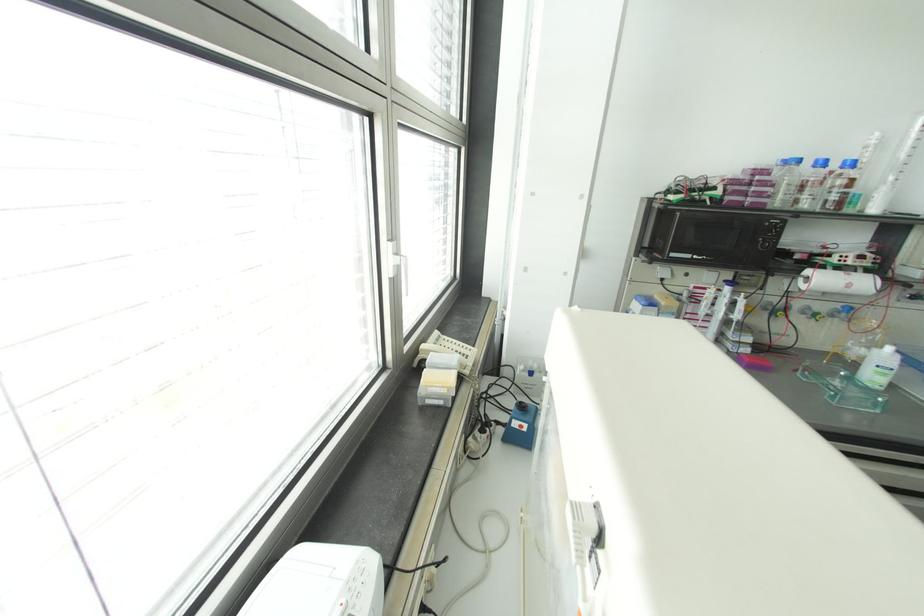
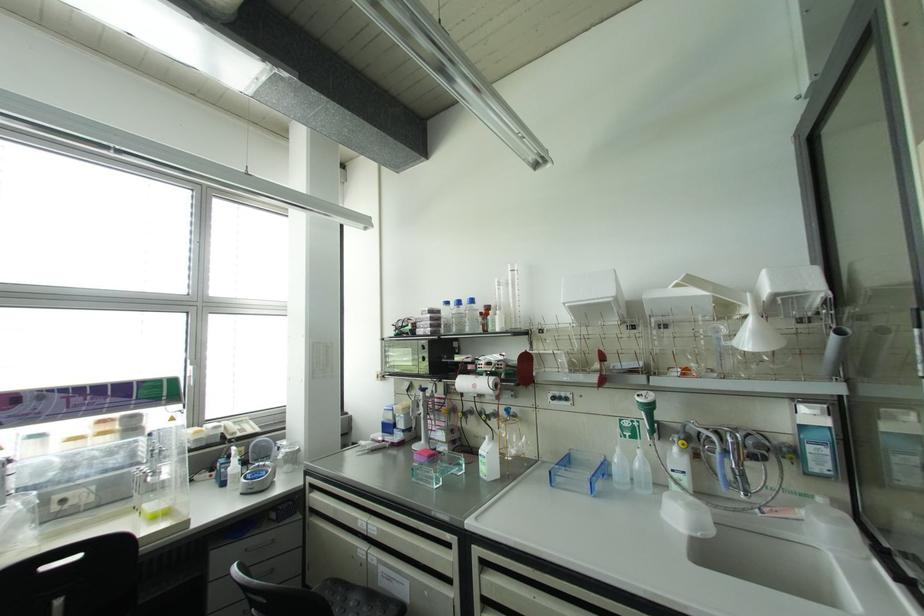
Where in the second image is the point corresponding to (x=848, y=285) from the first image?

(473, 386)